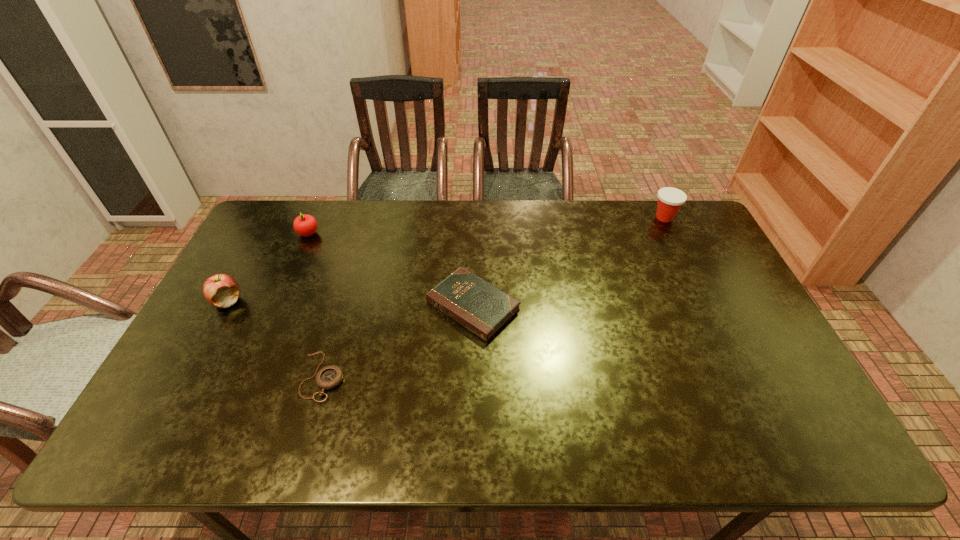
Where is `empty space that is in between the nearer apple and the nearest object`? This screenshot has height=540, width=960. empty space that is in between the nearer apple and the nearest object is located at coordinates (275, 339).

This screenshot has height=540, width=960. In order to click on vacant space in between the fourth tallest object and the nearest object in this screenshot , I will do `click(397, 341)`.

I want to click on free space that is in between the Bible and the pocket watch, so click(397, 341).

The image size is (960, 540). What are the coordinates of `object that can be found as the closest to the leftmost object` in the screenshot? It's located at (305, 225).

Find the location of `object that can be found as the second closest to the nearest object`. object that can be found as the second closest to the nearest object is located at coordinates (221, 290).

I want to click on free region that satisfies the following two spatial constraints: 1. on the back side of the second object from left to right; 2. on the right side of the Dixie cup, so click(315, 218).

Locate an element on the screen. free spot that satisfies the following two spatial constraints: 1. on the back side of the rightmost object; 2. on the left side of the leftmost object is located at coordinates (273, 218).

This screenshot has height=540, width=960. I want to click on blank space that satisfies the following two spatial constraints: 1. on the front side of the pocket watch; 2. on the left side of the farther apple, so click(x=247, y=376).